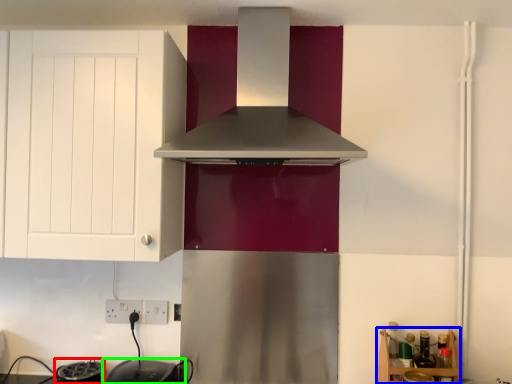
Question: Based on their relative distances, which object is farther from appliance (highlighted by a red box)? Choose from shelf (highlighted by a blue box) and appliance (highlighted by a green box).

Choices:
 (A) shelf
 (B) appliance

Answer: (A)